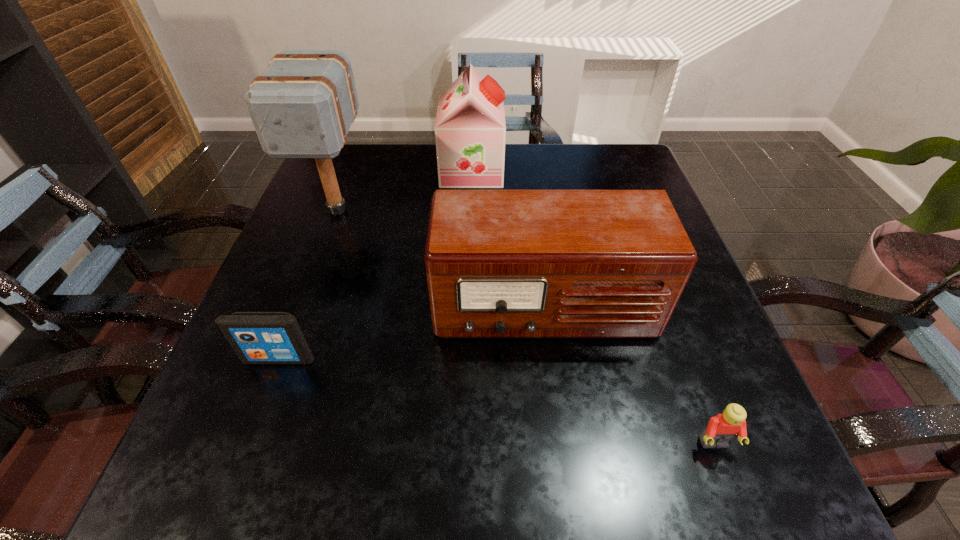
The image size is (960, 540). What are the coordinates of `free point between the shortest object and the radio receiver` in the screenshot? It's located at point(629,376).

This screenshot has height=540, width=960. Find the location of `empty space that is in between the shortest object and the radio receiver`. empty space that is in between the shortest object and the radio receiver is located at coordinates (629, 376).

Find the location of a particular element. The width and height of the screenshot is (960, 540). free space that is in between the tallest object and the iPod is located at coordinates (308, 284).

Select which object is the third closest to the fourth farthest object. Please provide its 2D coordinates. Your answer should be formatted as a tuple, i.e. [(x, y)], where the tuple contains the x and y coordinates of a point satisfying the conditions above.

[(470, 130)]

Locate an element on the screen. object that is the second closest to the tallest object is located at coordinates (499, 263).

The image size is (960, 540). What are the coordinates of `free point that satisfies the following two spatial constraints: 1. with the cap open on the second tallest object; 2. on the striking surface of the mallet` in the screenshot? It's located at (470, 210).

The width and height of the screenshot is (960, 540). I want to click on free region that satisfies the following two spatial constraints: 1. with the cap open on the soya milk; 2. on the front screen of the fourth farthest object, so 468,359.

This screenshot has width=960, height=540. Identify the location of vacant point that satisfies the following two spatial constraints: 1. with the cap open on the second tallest object; 2. on the striking surface of the tallest object. (470, 210).